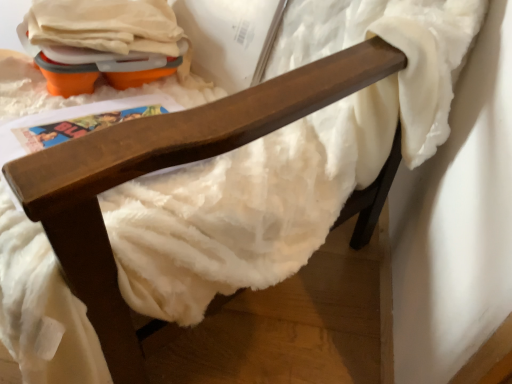
Question: Can you confirm if orange plastic egg carton at upper left is shorter than wooden chair arm at upper center?

Choices:
 (A) no
 (B) yes

Answer: (B)

Question: Does orange plastic egg carton at upper left come in front of wooden chair arm at upper center?

Choices:
 (A) no
 (B) yes

Answer: (A)

Question: Can you confirm if orange plastic egg carton at upper left is positioned to the right of wooden chair arm at upper center?

Choices:
 (A) yes
 (B) no

Answer: (B)

Question: Could you tell me if orange plastic egg carton at upper left is facing wooden chair arm at upper center?

Choices:
 (A) yes
 (B) no

Answer: (A)

Question: Is orange plastic egg carton at upper left taller than wooden chair arm at upper center?

Choices:
 (A) no
 (B) yes

Answer: (A)

Question: From a real-world perspective, is orange plastic egg carton at upper left positioned under wooden chair arm at upper center based on gravity?

Choices:
 (A) no
 (B) yes

Answer: (A)

Question: Is wooden chair arm at upper center looking in the opposite direction of orange plastic egg carton at upper left?

Choices:
 (A) no
 (B) yes

Answer: (B)

Question: Can you confirm if wooden chair arm at upper center is wider than orange plastic egg carton at upper left?

Choices:
 (A) yes
 (B) no

Answer: (A)

Question: Is wooden chair arm at upper center at the right side of orange plastic egg carton at upper left?

Choices:
 (A) no
 (B) yes

Answer: (B)

Question: Does wooden chair arm at upper center have a smaller size compared to orange plastic egg carton at upper left?

Choices:
 (A) yes
 (B) no

Answer: (B)

Question: Considering the relative sizes of wooden chair arm at upper center and orange plastic egg carton at upper left in the image provided, is wooden chair arm at upper center bigger than orange plastic egg carton at upper left?

Choices:
 (A) yes
 (B) no

Answer: (A)

Question: Could you tell me if wooden chair arm at upper center is turned towards orange plastic egg carton at upper left?

Choices:
 (A) yes
 (B) no

Answer: (A)

Question: Is point (291, 112) closer or farther from the camera than point (183, 52)?

Choices:
 (A) farther
 (B) closer

Answer: (B)